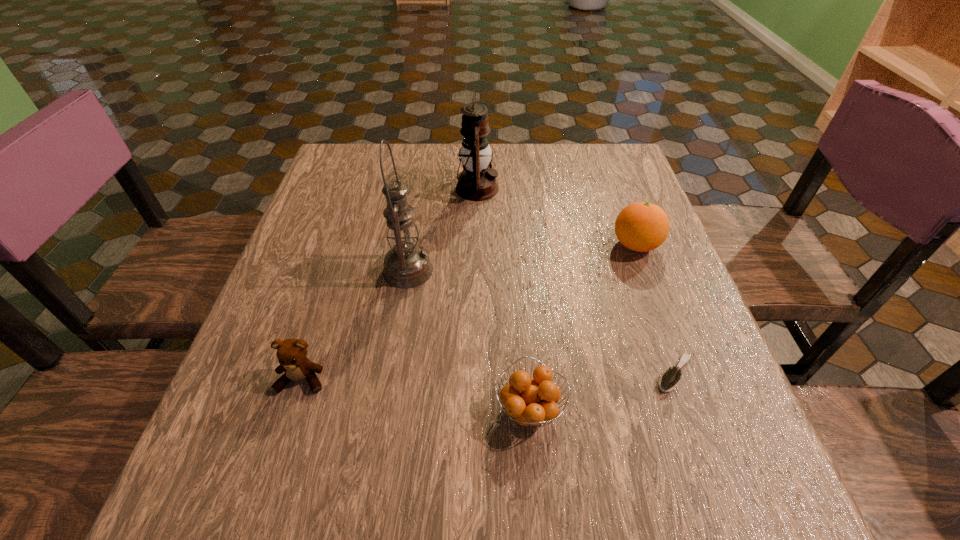
Where is `free point between the fifth tallest object and the teddy bear`? The width and height of the screenshot is (960, 540). free point between the fifth tallest object and the teddy bear is located at coordinates (416, 394).

Find the location of a particular element. The height and width of the screenshot is (540, 960). free point between the farther orange fruit and the shortest object is located at coordinates (655, 309).

The image size is (960, 540). What are the coordinates of `vacant space that is in between the lantern and the taller orange fruit` in the screenshot? It's located at (556, 217).

In order to click on the third closest object to the leftmost object in this screenshot , I will do `click(477, 182)`.

Find the location of `object that ranks as the closest to the shorter orange fruit`. object that ranks as the closest to the shorter orange fruit is located at coordinates (670, 379).

Identify the location of blank area in the image that satisfies the following two spatial constraints: 1. on the back side of the right orange fruit; 2. on the right side of the second shortest object. The height and width of the screenshot is (540, 960). (516, 245).

Where is `free space that satisfies the following two spatial constraints: 1. on the side of the lantern, there is a wick adjustment knob; 2. on the right side of the shortest object`? This screenshot has width=960, height=540. free space that satisfies the following two spatial constraints: 1. on the side of the lantern, there is a wick adjustment knob; 2. on the right side of the shortest object is located at coordinates (475, 373).